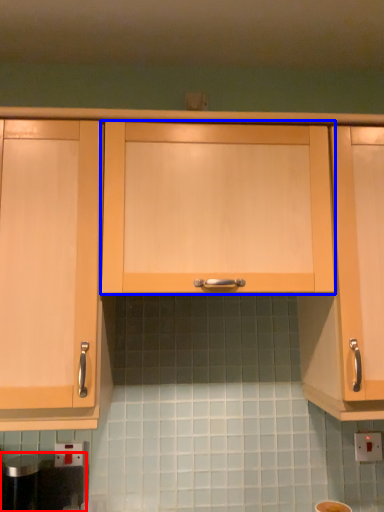
Question: Which object is closer to the camera taking this photo, appliance (highlighted by a red box) or cabinetry (highlighted by a blue box)?

Choices:
 (A) appliance
 (B) cabinetry

Answer: (B)